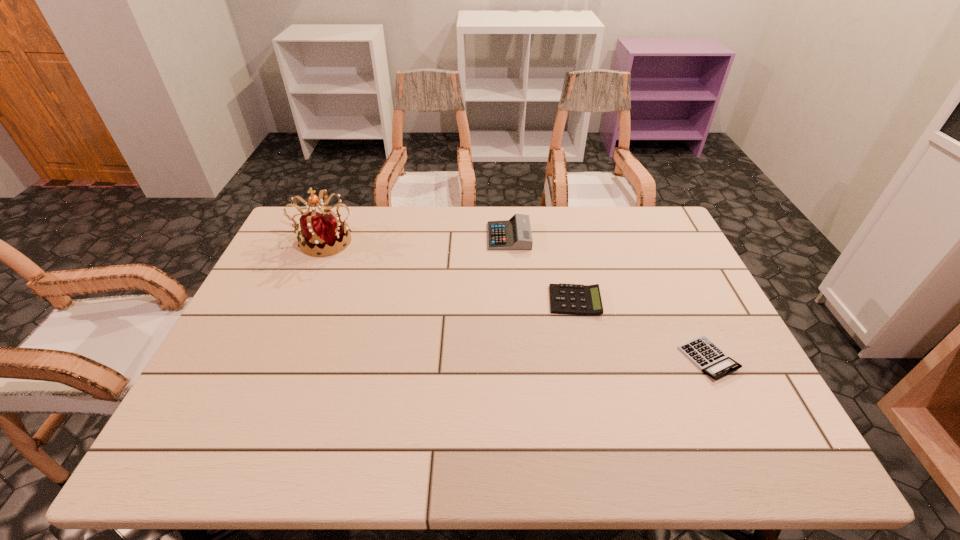
Image resolution: width=960 pixels, height=540 pixels. Find the location of `vacant area that lies between the tallest object and the leftmost calculator`. vacant area that lies between the tallest object and the leftmost calculator is located at coordinates (418, 238).

What are the coordinates of `free space between the tallest object and the shortest object` in the screenshot? It's located at (517, 299).

Identify the location of empty space that is in between the rightmost calculator and the farthest calculator. (609, 298).

You are a GUI agent. You are given a task and a screenshot of the screen. Output one action in this format:
    pyautogui.click(x=<x>, y=<y>)
    Task: Click on the object that ranks as the closest to the leftmost calculator
    
    Given the screenshot: What is the action you would take?
    pyautogui.click(x=572, y=299)

Locate an element on the screen. The height and width of the screenshot is (540, 960). the second closest object to the shortest object is located at coordinates (514, 234).

Identify the location of calculator that stands as the second closest to the rightmost calculator. The image size is (960, 540). (514, 234).

At what (x,y) coordinates should I click in order to perform the action: click on calculator that is the second closest one to the farthest calculator. Please return your answer as a coordinate pair (x, y). Image resolution: width=960 pixels, height=540 pixels. Looking at the image, I should click on (710, 359).

In order to click on free point that satisfies the following two spatial constraints: 1. on the front-facing side of the leftmost object; 2. on the left side of the second shortest object in this screenshot , I will do `click(300, 301)`.

In order to click on vacant point that satisfies the following two spatial constraints: 1. on the front side of the third shortest object; 2. on the right side of the second nearest object in this screenshot , I will do `click(514, 301)`.

Image resolution: width=960 pixels, height=540 pixels. What are the coordinates of `vacant area in the image that satisfies the following two spatial constraints: 1. on the front-facing side of the tallest object; 2. on the left side of the shortest calculator` in the screenshot? It's located at (276, 359).